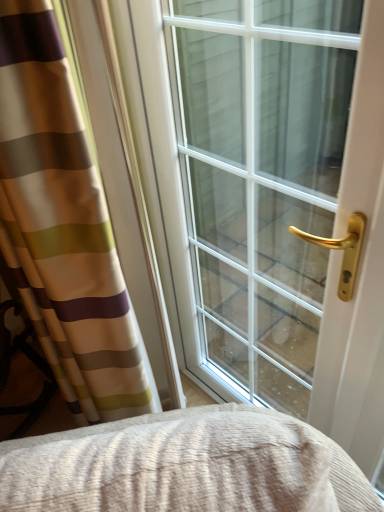
Question: Is clear glass window at center in front of or behind striped fabric curtain at left in the image?

Choices:
 (A) front
 (B) behind

Answer: (B)

Question: From the image's perspective, is clear glass window at center positioned above or below striped fabric curtain at left?

Choices:
 (A) below
 (B) above

Answer: (B)

Question: Considering the positions of clear glass window at center and striped fabric curtain at left in the image, is clear glass window at center taller or shorter than striped fabric curtain at left?

Choices:
 (A) short
 (B) tall

Answer: (B)

Question: From their relative heights in the image, would you say striped fabric curtain at left is taller or shorter than clear glass window at center?

Choices:
 (A) short
 (B) tall

Answer: (A)

Question: Relative to clear glass window at center, is striped fabric curtain at left in front or behind?

Choices:
 (A) front
 (B) behind

Answer: (A)

Question: Considering the positions of point (84, 205) and point (271, 368), is point (84, 205) closer or farther from the camera than point (271, 368)?

Choices:
 (A) farther
 (B) closer

Answer: (B)

Question: Is striped fabric curtain at left inside or outside of clear glass window at center?

Choices:
 (A) outside
 (B) inside

Answer: (A)